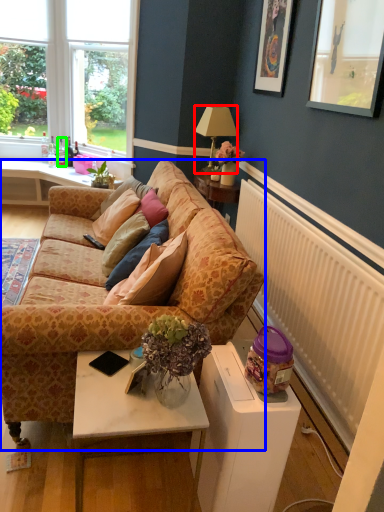
Question: Which object is positioned closest to lamp (highlighted by a red box)? Select from studio couch (highlighted by a blue box) and bottle (highlighted by a green box).

Choices:
 (A) studio couch
 (B) bottle

Answer: (B)